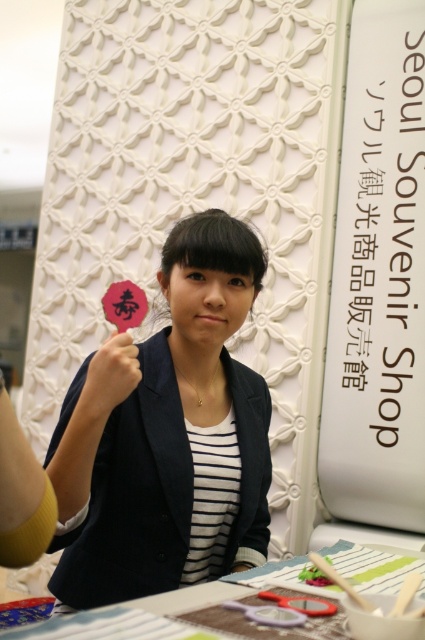
Question: Does matte black blazer at center have a lesser width compared to wooden table at lower center?

Choices:
 (A) no
 (B) yes

Answer: (B)

Question: Among these objects, which one is farthest from the camera?

Choices:
 (A) matte black blazer at center
 (B) matte black hand at upper left

Answer: (B)

Question: Is matte black blazer at center to the left of matte black hand at upper left from the viewer's perspective?

Choices:
 (A) no
 (B) yes

Answer: (A)

Question: Which object is positioned farthest from the wooden table at lower center?

Choices:
 (A) matte black hand at upper left
 (B) matte black blazer at center

Answer: (A)

Question: Which of these objects is positioned closest to the wooden table at lower center?

Choices:
 (A) matte black hand at upper left
 (B) matte black blazer at center

Answer: (B)

Question: Is matte black blazer at center wider than matte black hand at upper left?

Choices:
 (A) no
 (B) yes

Answer: (B)